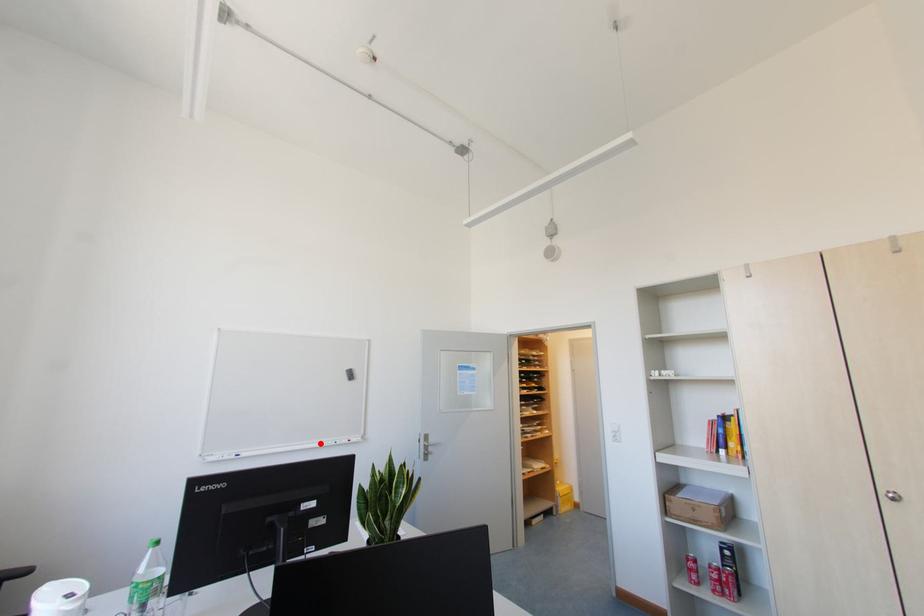
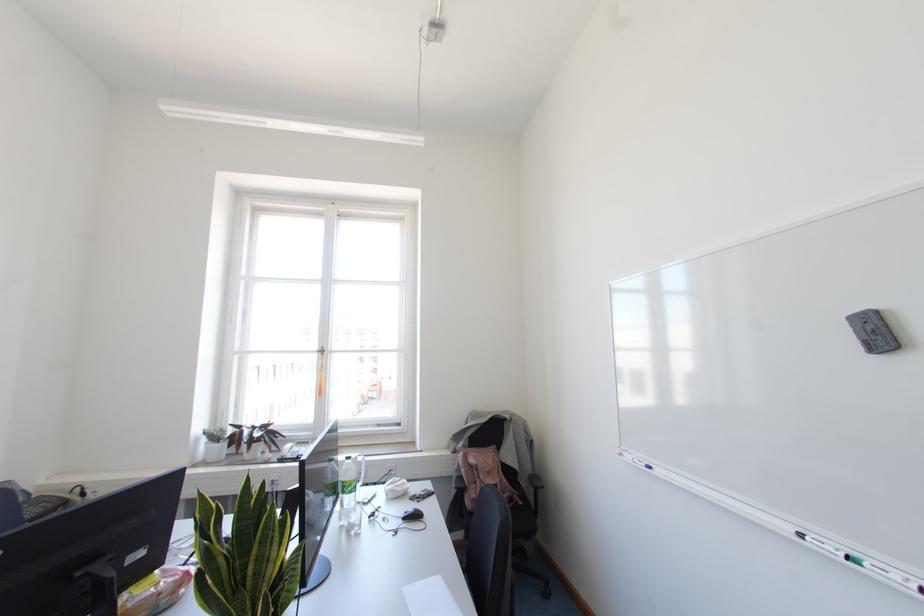
Find the pixel in the second image that matches the highlighted location in the first image.

(800, 536)